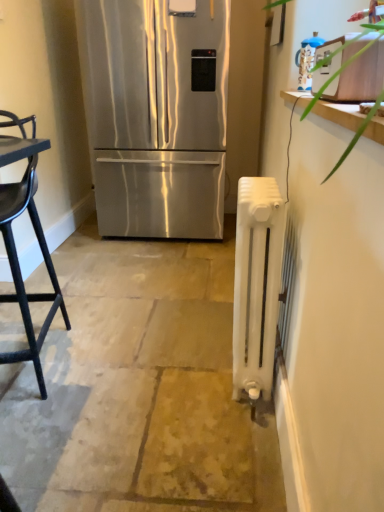
Question: From a real-world perspective, relative to stainless steel refrigerator at center, is white painted radiator at right vertically above or below?

Choices:
 (A) above
 (B) below

Answer: (B)

Question: Considering the positions of white painted radiator at right and stainless steel refrigerator at center in the image, is white painted radiator at right wider or thinner than stainless steel refrigerator at center?

Choices:
 (A) thin
 (B) wide

Answer: (A)

Question: Which object is the closest to the white painted radiator at right?

Choices:
 (A) white painted radiator at right
 (B) black matte chair at left
 (C) blue glossy kettle at upper right
 (D) stainless steel refrigerator at center

Answer: (A)

Question: Estimate the real-world distances between objects in this image. Which object is farther from the black matte chair at left?

Choices:
 (A) stainless steel refrigerator at center
 (B) blue glossy kettle at upper right
 (C) white painted radiator at right
 (D) white painted radiator at right

Answer: (B)